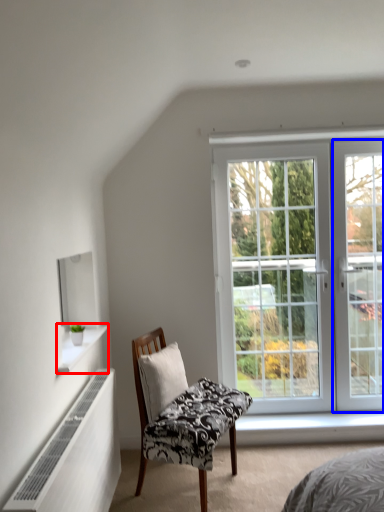
Question: Which point is further to the camera, window sill (highlighted by a red box) or screen door (highlighted by a blue box)?

Choices:
 (A) window sill
 (B) screen door

Answer: (B)